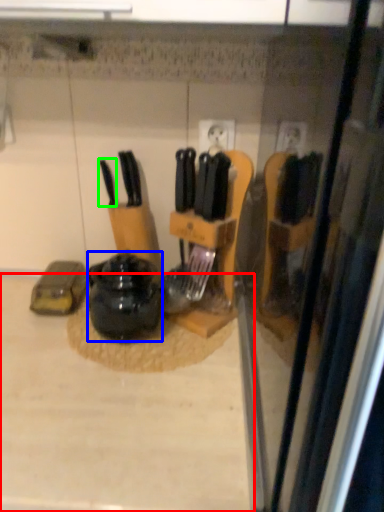
Question: Considering the real-world distances, which object is closest to counter top (highlighted by a red box)? kitchen appliance (highlighted by a blue box) or knife (highlighted by a green box).

Choices:
 (A) kitchen appliance
 (B) knife

Answer: (A)